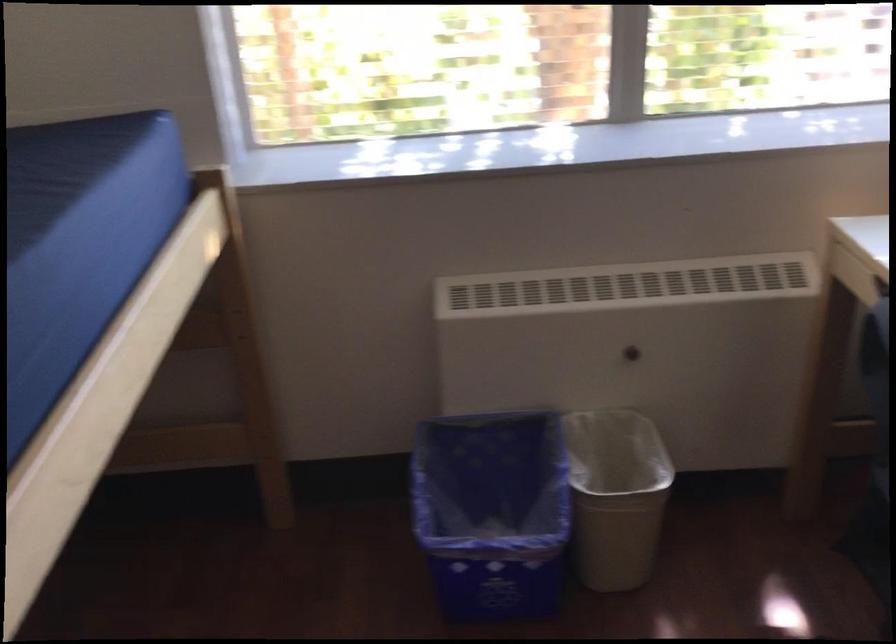
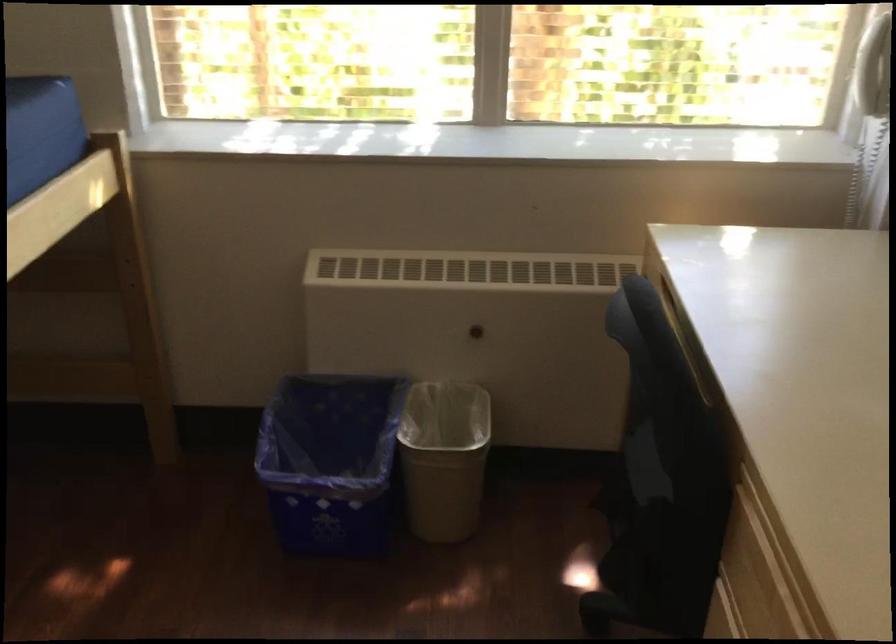
The images are taken continuously from a first-person perspective. In which direction are you moving?

The cameraman walked toward right, backward.